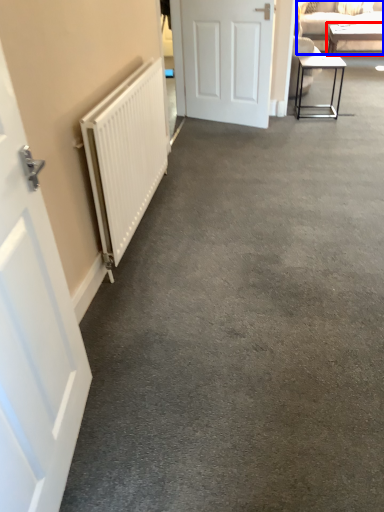
Question: Which object appears closest to the camera in this image, table (highlighted by a red box) or studio couch (highlighted by a blue box)?

Choices:
 (A) table
 (B) studio couch

Answer: (B)